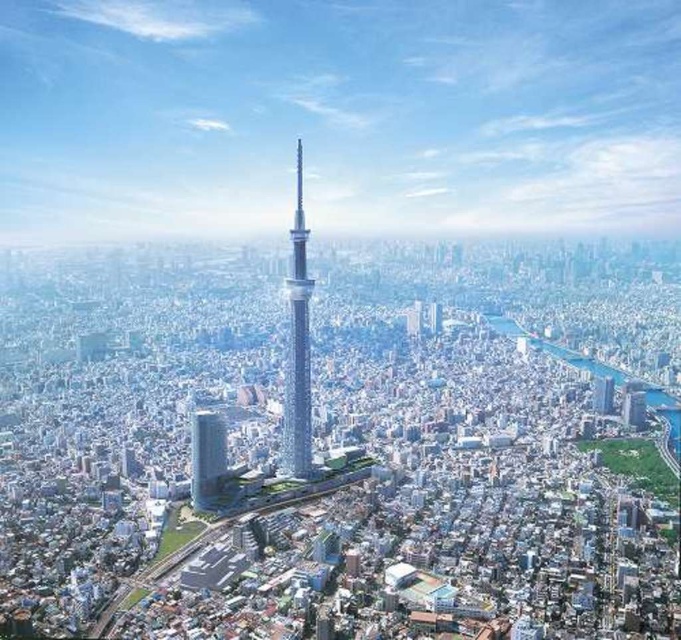
Question: Does sleek glass tower at center come behind smooth glass skyscraper at center?

Choices:
 (A) yes
 (B) no

Answer: (B)

Question: Can you confirm if sleek glass tower at center is positioned to the left of smooth glass skyscraper at center?

Choices:
 (A) yes
 (B) no

Answer: (B)

Question: Does sleek glass tower at center have a lesser width compared to smooth glass skyscraper at center?

Choices:
 (A) yes
 (B) no

Answer: (A)

Question: Which point is farther to the camera?

Choices:
 (A) sleek glass tower at center
 (B) smooth glass skyscraper at center

Answer: (B)

Question: Which object is closer to the camera taking this photo?

Choices:
 (A) sleek glass tower at center
 (B) smooth glass skyscraper at center

Answer: (A)

Question: Which point is closer to the camera?

Choices:
 (A) (298, 384)
 (B) (221, 445)

Answer: (A)